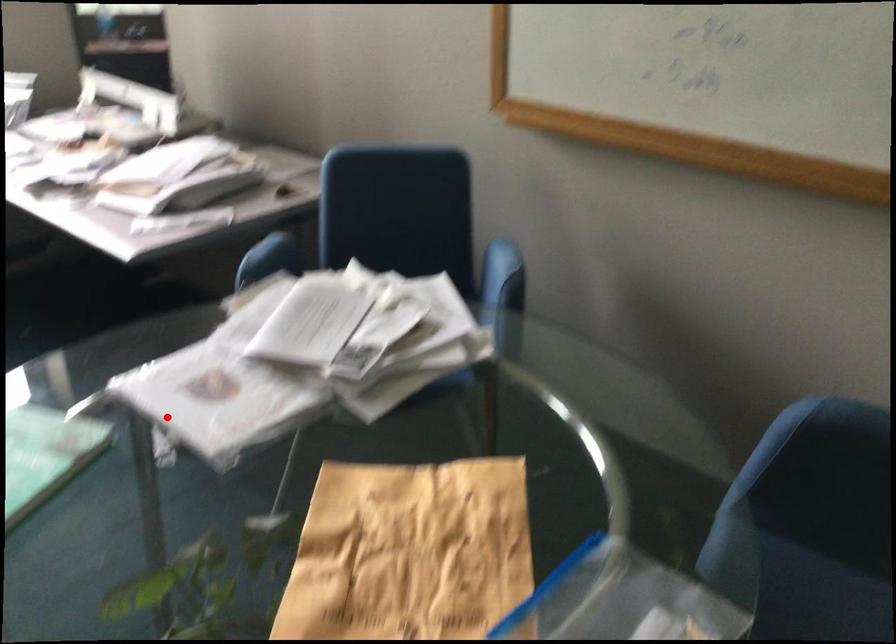
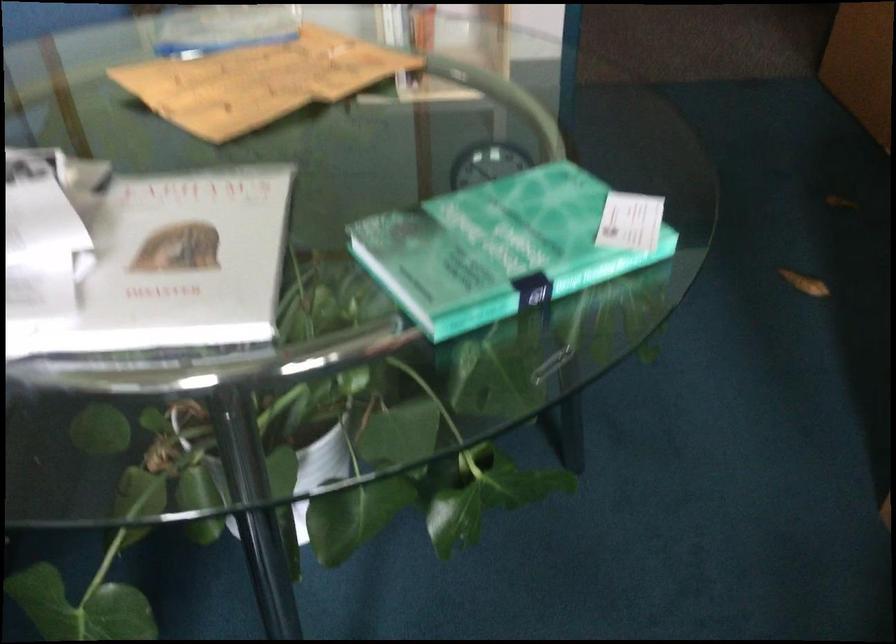
Locate, in the second image, the point that corresponds to the highlighted location in the first image.

(186, 259)